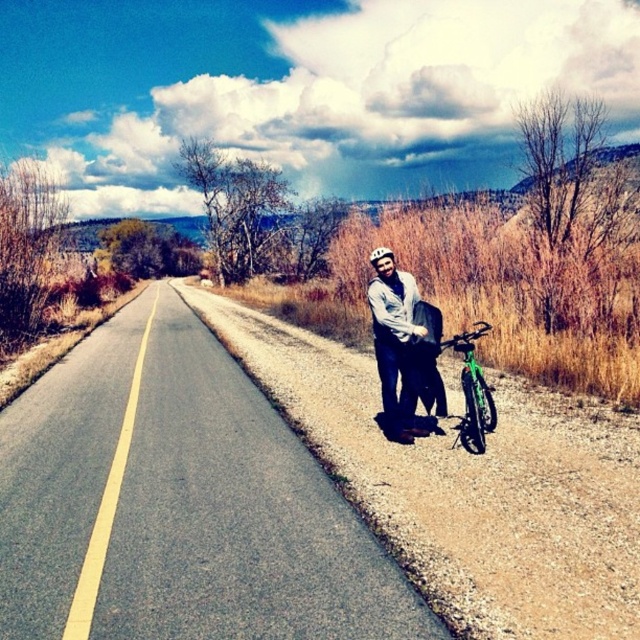
Question: Estimate the real-world distances between objects in this image. Which object is closer to the white matte bicycle helmet at center?

Choices:
 (A) matte gray helmet at right
 (B) green matte bicycle at right

Answer: (A)

Question: From the image, what is the correct spatial relationship of matte gray helmet at right in relation to green matte bicycle at right?

Choices:
 (A) above
 (B) below

Answer: (A)

Question: Among these points, which one is nearest to the camera?

Choices:
 (A) (376, 305)
 (B) (481, 326)

Answer: (A)

Question: Which object is closer to the camera taking this photo?

Choices:
 (A) matte gray helmet at right
 (B) green matte bicycle at right

Answer: (A)

Question: Is matte gray helmet at right to the right of white matte bicycle helmet at center from the viewer's perspective?

Choices:
 (A) no
 (B) yes

Answer: (A)

Question: Is green matte bicycle at right in front of white matte bicycle helmet at center?

Choices:
 (A) yes
 (B) no

Answer: (B)